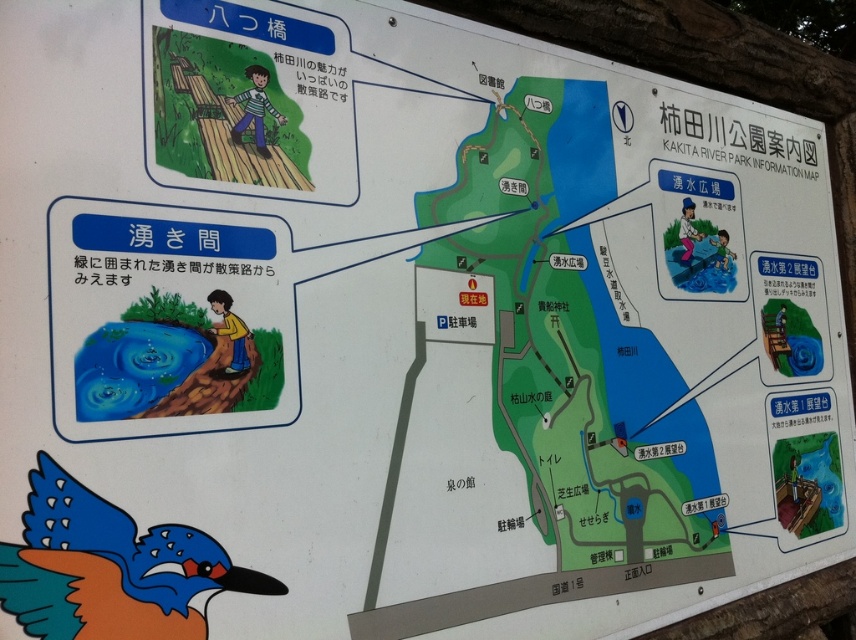
Question: Among these points, which one is nearest to the camera?

Choices:
 (A) (164, 48)
 (B) (164, 600)

Answer: (B)

Question: Is blue glossy kingfisher at lower left positioned behind wooden bridge at upper left?

Choices:
 (A) no
 (B) yes

Answer: (A)

Question: Which point appears closest to the camera in this image?

Choices:
 (A) (150, 321)
 (B) (39, 573)
 (C) (290, 84)

Answer: (B)

Question: Is blue glossy water at lower left to the right of wooden bridge at upper left from the viewer's perspective?

Choices:
 (A) no
 (B) yes

Answer: (A)

Question: Observing the image, what is the correct spatial positioning of blue glossy kingfisher at lower left in reference to wooden bridge at upper left?

Choices:
 (A) above
 (B) below

Answer: (B)

Question: Considering the real-world distances, which object is closest to the wooden bridge at upper left?

Choices:
 (A) blue glossy kingfisher at lower left
 (B) blue glossy water at lower left

Answer: (B)